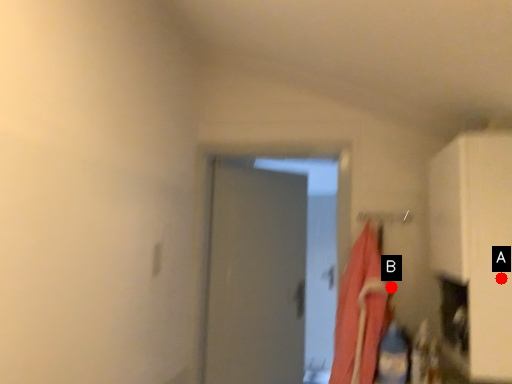
Question: Two points are circled on the image, labeled by A and B beside each circle. Among these points, which one is farthest from the camera?

Choices:
 (A) A is further
 (B) B is further

Answer: (B)